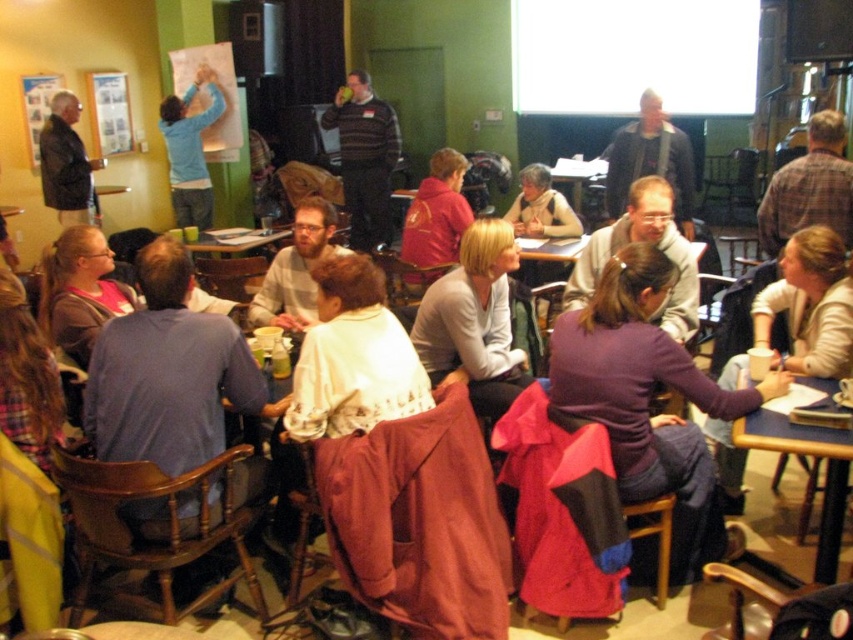
Question: Which of these objects is positioned farthest from the matte plastic table at center?

Choices:
 (A) wooden table at center
 (B) matte red hoodie at center
 (C) matte black jacket at center

Answer: (C)

Question: Does blue wood table at lower right appear on the right side of matte black jacket at left?

Choices:
 (A) no
 (B) yes

Answer: (B)

Question: Does blue wood table at lower right have a greater width compared to matte red hoodie at center?

Choices:
 (A) yes
 (B) no

Answer: (A)

Question: Which point is closer to the camera?

Choices:
 (A) striped sweater at center
 (B) light blue sweater at upper left
 (C) plaid shirt at center
 (D) matte black jacket at left

Answer: (C)

Question: Does matte black jacket at center have a greater width compared to matte red hoodie at center?

Choices:
 (A) yes
 (B) no

Answer: (A)

Question: Among these points, which one is farthest from the camera?

Choices:
 (A) (219, 248)
 (B) (544, 252)
 (C) (827, 202)

Answer: (A)